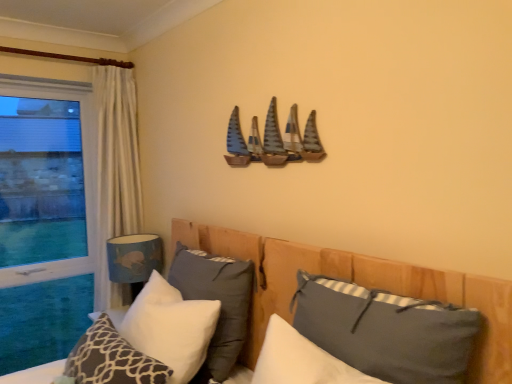
Question: Is wooden bed at center turned away from white soft pillow at center, which is counted as the third pillow, starting from the right?

Choices:
 (A) no
 (B) yes

Answer: (B)

Question: Is wooden bed at center far from white soft pillow at center, which is counted as the third pillow, starting from the right?

Choices:
 (A) yes
 (B) no

Answer: (B)

Question: Does wooden bed at center have a larger size compared to white soft pillow at center, which is counted as the third pillow, starting from the right?

Choices:
 (A) no
 (B) yes

Answer: (B)

Question: Does wooden bed at center lie in front of white soft pillow at center, which is counted as the third pillow, starting from the right?

Choices:
 (A) no
 (B) yes

Answer: (B)

Question: Does wooden bed at center have a lesser width compared to white soft pillow at center, which is the 3th pillow in left-to-right order?

Choices:
 (A) yes
 (B) no

Answer: (B)

Question: Is white textured pillow at lower left, the 5th pillow when ordered from right to left, wider or thinner than dark gray fabric pillow at center, the fourth pillow viewed from the left?

Choices:
 (A) wide
 (B) thin

Answer: (B)

Question: Considering their positions, is white textured pillow at lower left, the 5th pillow when ordered from right to left, located in front of or behind dark gray fabric pillow at center, the fourth pillow viewed from the left?

Choices:
 (A) behind
 (B) front

Answer: (A)

Question: From a real-world perspective, is white textured pillow at lower left, the 5th pillow when ordered from right to left, positioned above or below dark gray fabric pillow at center, the fourth pillow viewed from the left?

Choices:
 (A) below
 (B) above

Answer: (A)

Question: Visually, is white textured pillow at lower left, arranged as the 1th pillow when viewed from the left, positioned to the left or to the right of dark gray fabric pillow at center, the second pillow when ordered from right to left?

Choices:
 (A) left
 (B) right

Answer: (A)

Question: Relative to white textured pillow at lower left, arranged as the 1th pillow when viewed from the left, is blue fabric lampshade at lower left in front or behind?

Choices:
 (A) front
 (B) behind

Answer: (B)

Question: Is point (109, 269) closer or farther from the camera than point (111, 342)?

Choices:
 (A) farther
 (B) closer

Answer: (A)

Question: Would you say blue fabric lampshade at lower left is to the left or to the right of white textured pillow at lower left, the 5th pillow when ordered from right to left, in the picture?

Choices:
 (A) left
 (B) right

Answer: (A)

Question: From the image's perspective, relative to white textured pillow at lower left, arranged as the 1th pillow when viewed from the left, is blue fabric lampshade at lower left above or below?

Choices:
 (A) below
 (B) above

Answer: (B)

Question: Is transparent glass window at left to the left or to the right of white soft pillow at lower left, positioned as the second pillow in left-to-right order, in the image?

Choices:
 (A) left
 (B) right

Answer: (A)

Question: From the image's perspective, is transparent glass window at left positioned above or below white soft pillow at lower left, placed as the fourth pillow when sorted from right to left?

Choices:
 (A) above
 (B) below

Answer: (A)